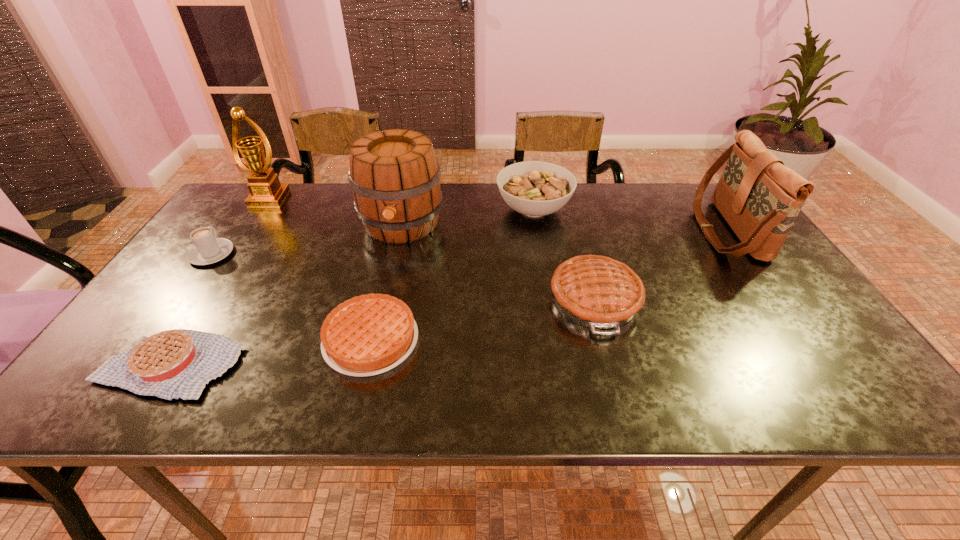
What are the coordinates of `object positioned at the near left corner` in the screenshot? It's located at (177, 363).

Find the location of a particular element. The image size is (960, 540). object that is at the far right corner is located at coordinates (760, 198).

Where is `free location at the far edge of the desktop`? Image resolution: width=960 pixels, height=540 pixels. free location at the far edge of the desktop is located at coordinates (455, 187).

Image resolution: width=960 pixels, height=540 pixels. In order to click on free space at the near edge of the desktop in this screenshot , I will do `click(540, 383)`.

Identify the location of vacant space at the right edge. (834, 340).

Locate an element on the screen. The width and height of the screenshot is (960, 540). blank space at the far left corner is located at coordinates (235, 199).

Where is `vacant space that's between the award and the shoulder bag`? This screenshot has width=960, height=540. vacant space that's between the award and the shoulder bag is located at coordinates (497, 214).

Identify the location of free spot between the leftmost pie and the stew. (351, 287).

Where is `free space between the rightmost pie and the award`? The width and height of the screenshot is (960, 540). free space between the rightmost pie and the award is located at coordinates (432, 249).

In order to click on vacant area that lies between the cider and the shoulder bag in this screenshot , I will do `click(564, 227)`.